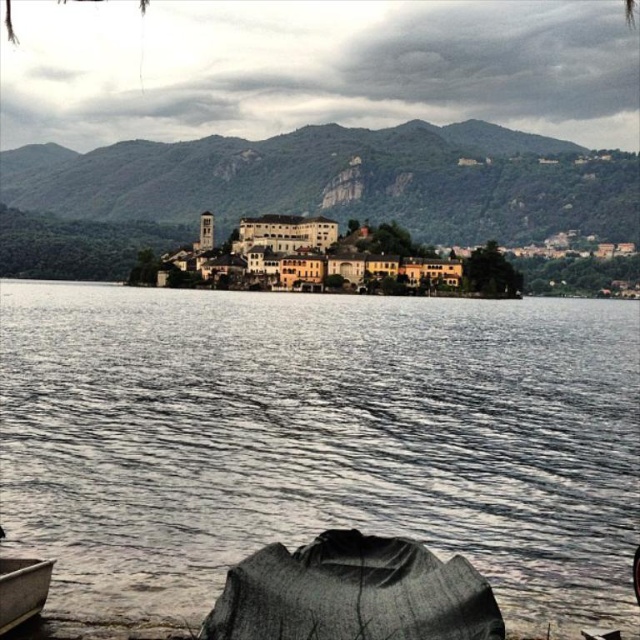
This screenshot has height=640, width=640. Describe the element at coordinates (317, 440) in the screenshot. I see `gray water at center` at that location.

Is gray water at center wider than wooden canoe at lower left?

Correct, the width of gray water at center exceeds that of wooden canoe at lower left.

Between point (237, 346) and point (19, 572), which one is positioned in front?

Point (19, 572)

In order to click on gray water at center in this screenshot , I will do `click(317, 440)`.